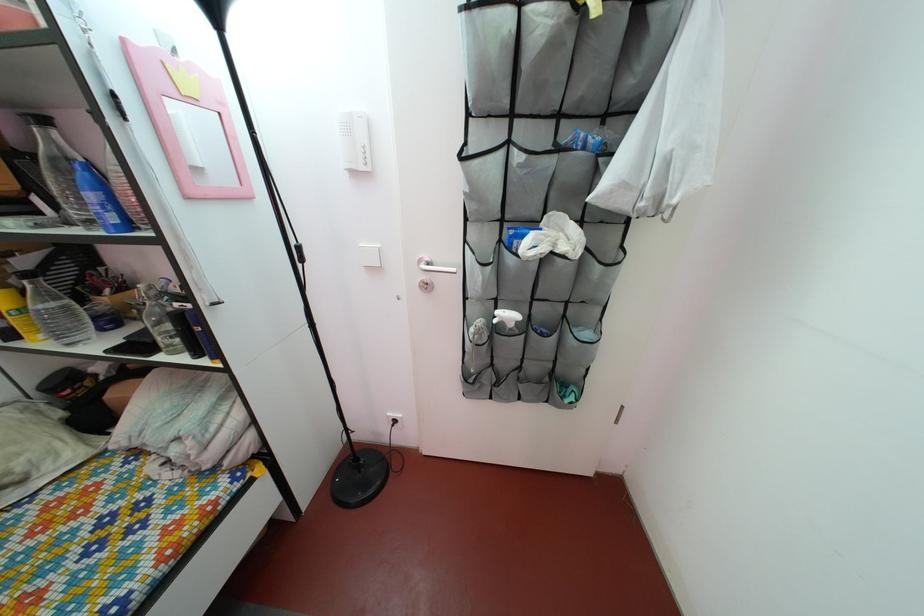
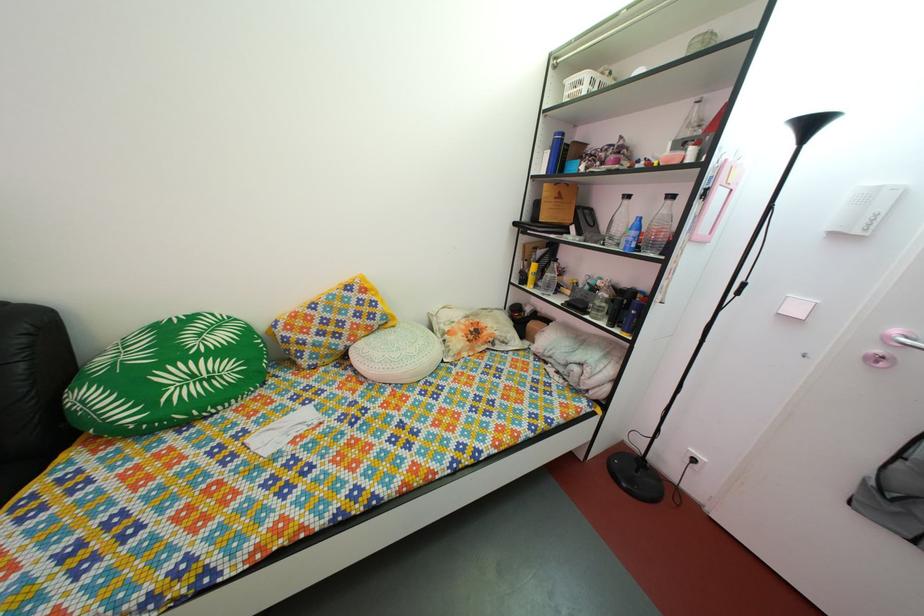
Question: The camera is either moving clockwise (left) or counter-clockwise (right) around the object. The first image is from the beginning of the video and the second image is from the end. Is the camera moving left or right when shooting the video?

Choices:
 (A) Left
 (B) Right

Answer: (B)